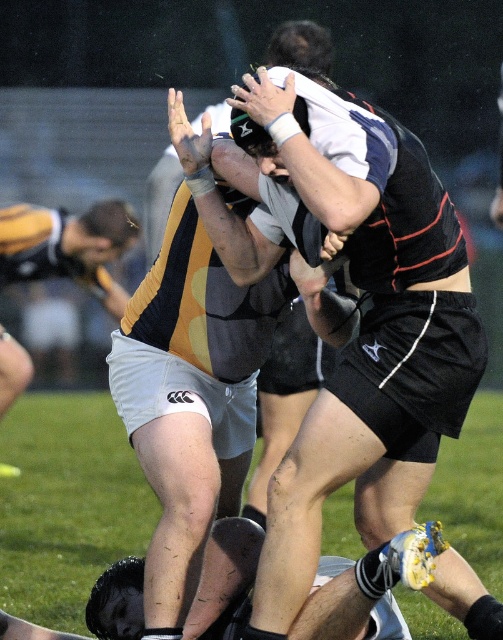
You are a rugby coach observing the scrum formation. You notice the black jersey at center and the white matte shorts at center. Which player is positioned to the right of the other?

The black jersey at center is positioned on the right side of white matte shorts at center, so the black jersey at center is to the right of the white matte shorts at center.